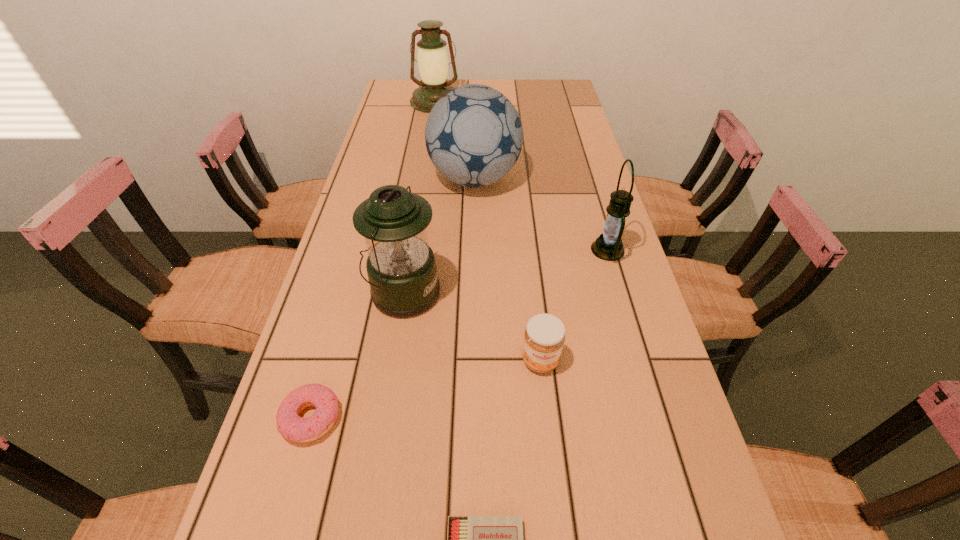
Image resolution: width=960 pixels, height=540 pixels. In order to click on object that is the second closest to the farthest lantern in this screenshot , I will do `click(608, 246)`.

Find the location of a particular element. the fourth closest object relative to the shortest object is located at coordinates (608, 246).

At what (x,y) coordinates should I click in order to perform the action: click on lantern that is the third nearest to the sixth nearest object. Please return your answer as a coordinate pair (x, y). The image size is (960, 540). Looking at the image, I should click on (432, 58).

Select which lantern is the second closest to the rightmost object. Please provide its 2D coordinates. Your answer should be formatted as a tuple, i.e. [(x, y)], where the tuple contains the x and y coordinates of a point satisfying the conditions above.

[(432, 58)]

This screenshot has width=960, height=540. Find the location of `free space in the image that satisfies the following two spatial constraints: 1. on the side where the fifth nearest object emits light; 2. on the front side of the second nearest object`. free space in the image that satisfies the following two spatial constraints: 1. on the side where the fifth nearest object emits light; 2. on the front side of the second nearest object is located at coordinates (658, 418).

Locate an element on the screen. free space that satisfies the following two spatial constraints: 1. on the side where the rightmost object emits light; 2. on the front side of the nearest lantern is located at coordinates (620, 292).